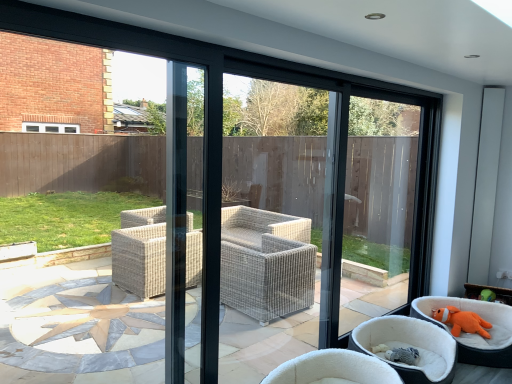
This screenshot has height=384, width=512. In order to click on white wicker chair at center, the first chair from the left in this screenshot , I will do `click(333, 369)`.

Identify the location of orange plush toy at lower right, which is the 2th chair from left to right. (409, 346).

Find the location of a particular element. The width and height of the screenshot is (512, 384). orange plush toy at lower right, the third chair positioned from the left is located at coordinates (474, 334).

Identify the location of white wicker chair at center, the first chair from the left. The image size is (512, 384). click(x=333, y=369).

Considering the relative positions of orange plush toy at lower right, which is the 2th chair in right-to-left order, and orange plush toy at lower right in the image provided, is orange plush toy at lower right, which is the 2th chair in right-to-left order, to the left of orange plush toy at lower right from the viewer's perspective?

Yes, orange plush toy at lower right, which is the 2th chair in right-to-left order, is to the left of orange plush toy at lower right.

Considering the sizes of orange plush toy at lower right, which is the 2th chair in right-to-left order, and orange plush toy at lower right in the image, is orange plush toy at lower right, which is the 2th chair in right-to-left order, taller or shorter than orange plush toy at lower right?

orange plush toy at lower right, which is the 2th chair in right-to-left order, is taller than orange plush toy at lower right.

Would you consider orange plush toy at lower right, which is the 2th chair from left to right, to be distant from orange plush toy at lower right?

No, orange plush toy at lower right, which is the 2th chair from left to right, is in close proximity to orange plush toy at lower right.

Where is `the 2nd chair in front of the orange plush toy at lower right, starting your count from the anchor`? the 2nd chair in front of the orange plush toy at lower right, starting your count from the anchor is located at coordinates (409, 346).

In the image, is orange plush toy at lower right, the third chair positioned from the left, positioned in front of or behind orange plush toy at lower right?

In the image, orange plush toy at lower right, the third chair positioned from the left, appears in front of orange plush toy at lower right.

Who is shorter, orange plush toy at lower right, placed as the first chair when sorted from right to left, or orange plush toy at lower right?

With less height is orange plush toy at lower right.

Is point (456, 320) positioned before point (380, 325)?

No, it is not.

Is orange plush toy at lower right facing away from orange plush toy at lower right, which is the 2th chair from left to right?

That's not correct — orange plush toy at lower right is not looking away from orange plush toy at lower right, which is the 2th chair from left to right.

From a real-world perspective, which is physically below, orange plush toy at lower right or orange plush toy at lower right, which is the 2th chair from left to right?

In real-world perspective, orange plush toy at lower right, which is the 2th chair from left to right, is lower.

Is white wicker chair at center, the third chair when ordered from right to left, inside or outside of orange plush toy at lower right?

white wicker chair at center, the third chair when ordered from right to left, is located beyond the bounds of orange plush toy at lower right.

Does white wicker chair at center, the third chair when ordered from right to left, lie in front of orange plush toy at lower right?

Yes.

How many degrees apart are the facing directions of white wicker chair at center, the first chair from the left, and orange plush toy at lower right?

The angular difference between white wicker chair at center, the first chair from the left, and orange plush toy at lower right is 78.2 degrees.

Measure the distance between white wicker chair at center, the first chair from the left, and orange plush toy at lower right.

A distance of 3.94 feet exists between white wicker chair at center, the first chair from the left, and orange plush toy at lower right.

Which is more to the left, orange plush toy at lower right, which is the 2th chair in right-to-left order, or white wicker chair at center, the third chair when ordered from right to left?

white wicker chair at center, the third chair when ordered from right to left.

Who is smaller, orange plush toy at lower right, which is the 2th chair in right-to-left order, or white wicker chair at center, the first chair from the left?

A: Smaller between the two is orange plush toy at lower right, which is the 2th chair in right-to-left order.

From the image's perspective, is orange plush toy at lower right, which is the 2th chair in right-to-left order, positioned above or below white wicker chair at center, the third chair when ordered from right to left?

orange plush toy at lower right, which is the 2th chair in right-to-left order, is situated higher than white wicker chair at center, the third chair when ordered from right to left, in the image.

Is orange plush toy at lower right, which is the 2th chair in right-to-left order, completely or partially outside of white wicker chair at center, the third chair when ordered from right to left?

Yes, orange plush toy at lower right, which is the 2th chair in right-to-left order, is outside of white wicker chair at center, the third chair when ordered from right to left.

Is orange plush toy at lower right, placed as the first chair when sorted from right to left, far from orange plush toy at lower right, which is the 2th chair from left to right?

No, there isn't a large distance between orange plush toy at lower right, placed as the first chair when sorted from right to left, and orange plush toy at lower right, which is the 2th chair from left to right.

Considering the points (445, 301) and (428, 345), which point is behind, point (445, 301) or point (428, 345)?

Positioned behind is point (445, 301).

In terms of width, does orange plush toy at lower right, placed as the first chair when sorted from right to left, look wider or thinner when compared to orange plush toy at lower right, which is the 2th chair in right-to-left order?

Considering their sizes, orange plush toy at lower right, placed as the first chair when sorted from right to left, looks broader than orange plush toy at lower right, which is the 2th chair in right-to-left order.

Can you confirm if orange plush toy at lower right, the third chair positioned from the left, is shorter than orange plush toy at lower right, which is the 2th chair in right-to-left order?

Incorrect, the height of orange plush toy at lower right, the third chair positioned from the left, does not fall short of that of orange plush toy at lower right, which is the 2th chair in right-to-left order.

Is orange plush toy at lower right located outside white wicker chair at center, the first chair from the left?

orange plush toy at lower right is positioned outside white wicker chair at center, the first chair from the left.

From the picture: Is orange plush toy at lower right taller or shorter than white wicker chair at center, the first chair from the left?

Considering their sizes, orange plush toy at lower right has less height than white wicker chair at center, the first chair from the left.

Between orange plush toy at lower right and white wicker chair at center, the first chair from the left, which one appears on the right side from the viewer's perspective?

Positioned to the right is orange plush toy at lower right.

Is orange plush toy at lower right positioned far away from white wicker chair at center, the first chair from the left?

Absolutely, orange plush toy at lower right is distant from white wicker chair at center, the first chair from the left.

The image size is (512, 384). In order to click on animal that appears above the orange plush toy at lower right, which is the 2th chair from left to right (from a real-world perspective) in this screenshot , I will do `click(462, 321)`.

Where is `animal above the orange plush toy at lower right, placed as the first chair when sorted from right to left (from the image's perspective)`? This screenshot has width=512, height=384. animal above the orange plush toy at lower right, placed as the first chair when sorted from right to left (from the image's perspective) is located at coordinates (462, 321).

When comparing their distances from orange plush toy at lower right, which is the 2th chair from left to right, does white wicker chair at center, the first chair from the left, or orange plush toy at lower right seem closer?

white wicker chair at center, the first chair from the left, is closer to orange plush toy at lower right, which is the 2th chair from left to right.

From the picture: Considering their positions, is orange plush toy at lower right, which is the 2th chair in right-to-left order, positioned closer to orange plush toy at lower right, placed as the first chair when sorted from right to left, than white wicker chair at center, the first chair from the left?

orange plush toy at lower right, which is the 2th chair in right-to-left order, is closer to orange plush toy at lower right, placed as the first chair when sorted from right to left.

Consider the image. Looking at the image, which one is located closer to orange plush toy at lower right, orange plush toy at lower right, which is the 2th chair in right-to-left order, or orange plush toy at lower right, placed as the first chair when sorted from right to left?

The object closer to orange plush toy at lower right is orange plush toy at lower right, placed as the first chair when sorted from right to left.

Looking at the image, which one is located closer to orange plush toy at lower right, the third chair positioned from the left, orange plush toy at lower right or white wicker chair at center, the first chair from the left?

Based on the image, orange plush toy at lower right appears to be nearer to orange plush toy at lower right, the third chair positioned from the left.

Based on their spatial positions, is orange plush toy at lower right, which is the 2th chair from left to right, or orange plush toy at lower right closer to white wicker chair at center, the first chair from the left?

orange plush toy at lower right, which is the 2th chair from left to right, lies closer to white wicker chair at center, the first chair from the left, than the other object.

Estimate the real-world distances between objects in this image. Which object is further from orange plush toy at lower right, which is the 2th chair from left to right, orange plush toy at lower right, the third chair positioned from the left, or orange plush toy at lower right?

orange plush toy at lower right is positioned further to the anchor orange plush toy at lower right, which is the 2th chair from left to right.

Considering their positions, is white wicker chair at center, the third chair when ordered from right to left, positioned closer to orange plush toy at lower right than orange plush toy at lower right, which is the 2th chair from left to right?

orange plush toy at lower right, which is the 2th chair from left to right, is closer to orange plush toy at lower right.

Estimate the real-world distances between objects in this image. Which object is closer to white wicker chair at center, the third chair when ordered from right to left, orange plush toy at lower right, which is the 2th chair from left to right, or orange plush toy at lower right, the third chair positioned from the left?

Among the two, orange plush toy at lower right, which is the 2th chair from left to right, is located nearer to white wicker chair at center, the third chair when ordered from right to left.

I want to click on chair between white wicker chair at center, the first chair from the left, and orange plush toy at lower right, placed as the first chair when sorted from right to left, in the horizontal direction, so click(409, 346).

In order to click on chair between orange plush toy at lower right, which is the 2th chair in right-to-left order, and orange plush toy at lower right from front to back in this screenshot , I will do `click(474, 334)`.